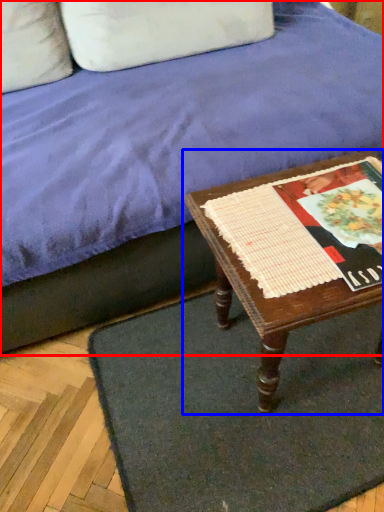
Question: Which object is further to the camera taking this photo, studio couch (highlighted by a red box) or table (highlighted by a blue box)?

Choices:
 (A) studio couch
 (B) table

Answer: (B)